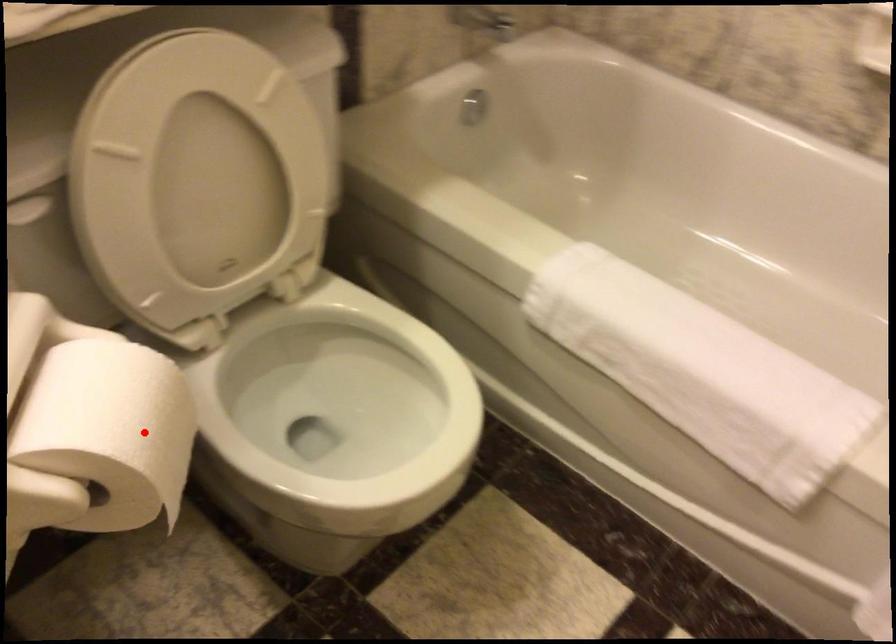
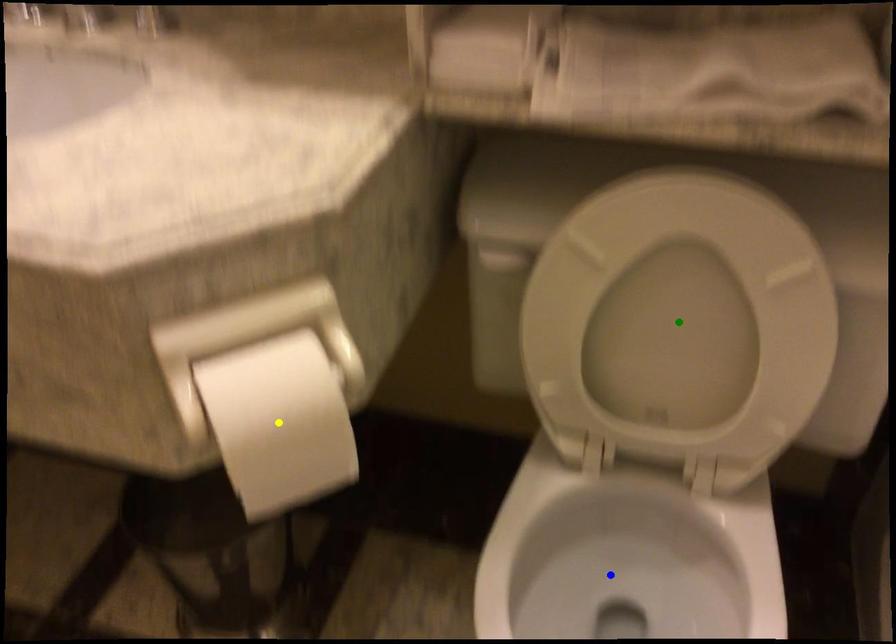
Question: I am providing you with two images of the same scene from different viewpoints. A red point is marked on the first image. You are given multiple points on the second image. Which spot in image 2 lines up with the point in image 1?

Choices:
 (A) yellow point
 (B) green point
 (C) blue point

Answer: (A)